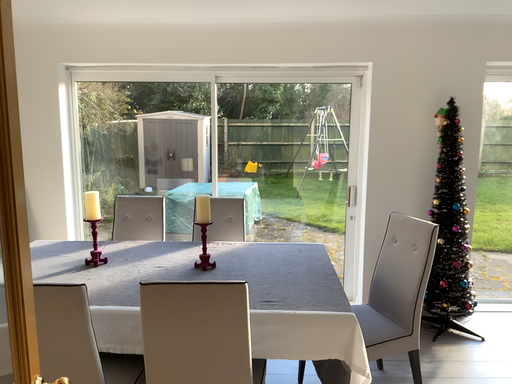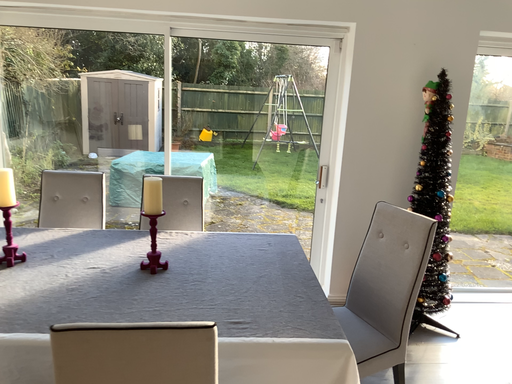
Question: Which way did the camera rotate in the video?

Choices:
 (A) rotated left
 (B) rotated right

Answer: (B)